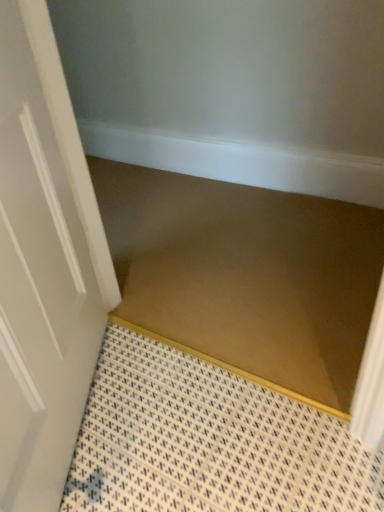
The height and width of the screenshot is (512, 384). Identify the location of white glossy door at left. (44, 264).

Image resolution: width=384 pixels, height=512 pixels. Describe the element at coordinates (44, 264) in the screenshot. I see `white glossy door at left` at that location.

Locate an element on the screen. Image resolution: width=384 pixels, height=512 pixels. brown matte stair at center is located at coordinates (246, 273).

Describe the element at coordinates (246, 273) in the screenshot. This screenshot has height=512, width=384. I see `brown matte stair at center` at that location.

You are a GUI agent. You are given a task and a screenshot of the screen. Output one action in this format:
    pyautogui.click(x=<x>, y=<y>)
    Task: Click on the white glossy door at left
    
    Given the screenshot: What is the action you would take?
    pyautogui.click(x=44, y=264)

Which object is positioned more to the left, brown matte stair at center or white glossy door at left?

Positioned to the left is white glossy door at left.

Does brown matte stair at center lie in front of white glossy door at left?

No, brown matte stair at center is behind white glossy door at left.

Considering the positions of point (359, 223) and point (15, 287), is point (359, 223) closer or farther from the camera than point (15, 287)?

Point (359, 223) is farther from the camera than point (15, 287).

From the image's perspective, which one is positioned lower, brown matte stair at center or white glossy door at left?

white glossy door at left appears lower in the image.

From a real-world perspective, who is located lower, brown matte stair at center or white glossy door at left?

From a 3D spatial view, brown matte stair at center is below.

Is brown matte stair at center wider or thinner than white glossy door at left?

Considering their sizes, brown matte stair at center looks broader than white glossy door at left.

Considering the sizes of objects brown matte stair at center and white glossy door at left in the image provided, who is taller, brown matte stair at center or white glossy door at left?

white glossy door at left.

Who is bigger, brown matte stair at center or white glossy door at left?

With larger size is white glossy door at left.

Do you think brown matte stair at center is within white glossy door at left, or outside of it?

brown matte stair at center is outside white glossy door at left.

Is brown matte stair at center not near white glossy door at left?

No.

Is brown matte stair at center aimed at white glossy door at left?

No, brown matte stair at center is not facing towards white glossy door at left.

How many degrees apart are the facing directions of brown matte stair at center and white glossy door at left?

119 degrees separate the facing orientations of brown matte stair at center and white glossy door at left.

The width and height of the screenshot is (384, 512). What are the coordinates of `door located on the left of brown matte stair at center` in the screenshot? It's located at (44, 264).

Is white glossy door at left at the left side of brown matte stair at center?

Yes, white glossy door at left is to the left of brown matte stair at center.

Does white glossy door at left lie behind brown matte stair at center?

No, it is in front of brown matte stair at center.

Which is in front, point (97, 307) or point (147, 277)?

Positioned in front is point (97, 307).

From the image's perspective, is white glossy door at left positioned above or below brown matte stair at center?

white glossy door at left is situated lower than brown matte stair at center in the image.

From a real-world perspective, is white glossy door at left physically below brown matte stair at center?

No, from a real-world perspective, white glossy door at left is not beneath brown matte stair at center.

In terms of width, does white glossy door at left look wider or thinner when compared to brown matte stair at center?

Considering their sizes, white glossy door at left looks slimmer than brown matte stair at center.

Who is taller, white glossy door at left or brown matte stair at center?

With more height is white glossy door at left.

Considering the sizes of white glossy door at left and brown matte stair at center in the image, is white glossy door at left bigger or smaller than brown matte stair at center?

In the image, white glossy door at left appears to be larger than brown matte stair at center.

Could brown matte stair at center be considered to be inside white glossy door at left?

Definitely not — brown matte stair at center is not inside white glossy door at left.

Is there a large distance between white glossy door at left and brown matte stair at center?

Actually, white glossy door at left and brown matte stair at center are a little close together.

Is brown matte stair at center at the back of white glossy door at left?

white glossy door at left does not have its back to brown matte stair at center.

What's the angular difference between white glossy door at left and brown matte stair at center's facing directions?

They differ by 119 degrees in their facing directions.

Find the location of a particular element. The image size is (384, 512). door that appears in front of the brown matte stair at center is located at coordinates (44, 264).

This screenshot has width=384, height=512. What are the coordinates of `door in front of the brown matte stair at center` in the screenshot? It's located at (44, 264).

The image size is (384, 512). In order to click on door that is below the brown matte stair at center (from the image's perspective) in this screenshot , I will do `click(44, 264)`.